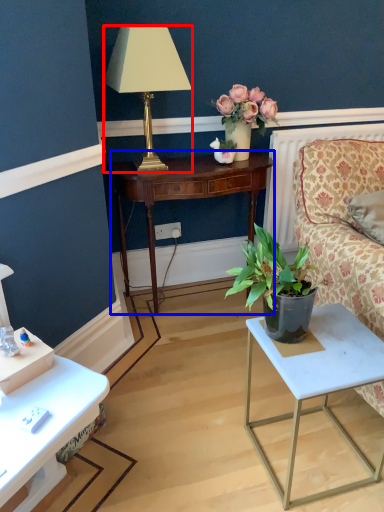
Question: Which of the following is the farthest to the observer, lamp (highlighted by a red box) or nightstand (highlighted by a blue box)?

Choices:
 (A) lamp
 (B) nightstand

Answer: (B)